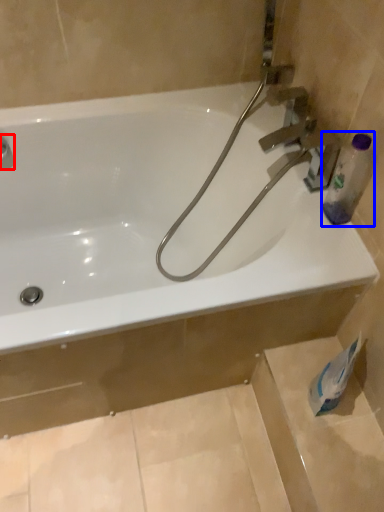
Question: Which object is closer to the camera taking this photo, plumbing fixture (highlighted by a red box) or bottle (highlighted by a blue box)?

Choices:
 (A) plumbing fixture
 (B) bottle

Answer: (B)